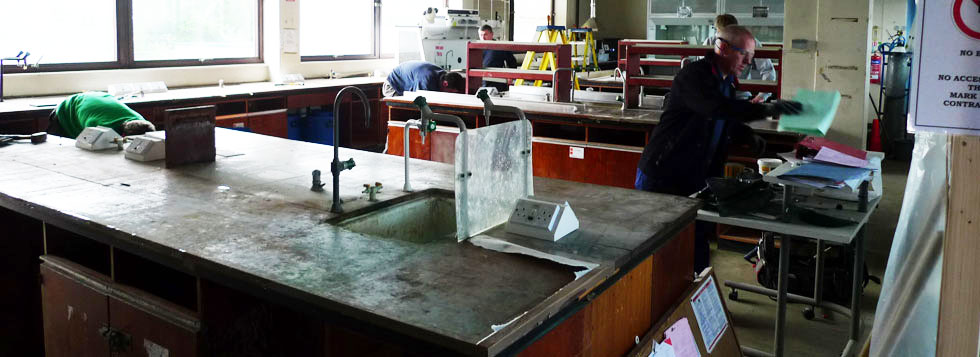
At what (x,y) coordinates should I click in order to perform the action: click on outlets. Please return your answer as a coordinate pair (x, y). This screenshot has width=980, height=357. Looking at the image, I should click on (92, 137), (141, 147), (547, 217).